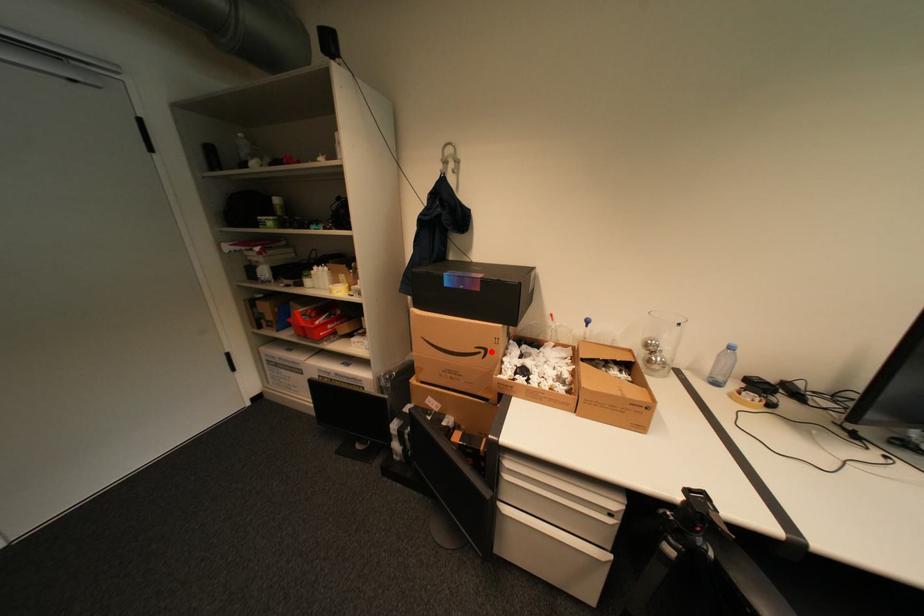
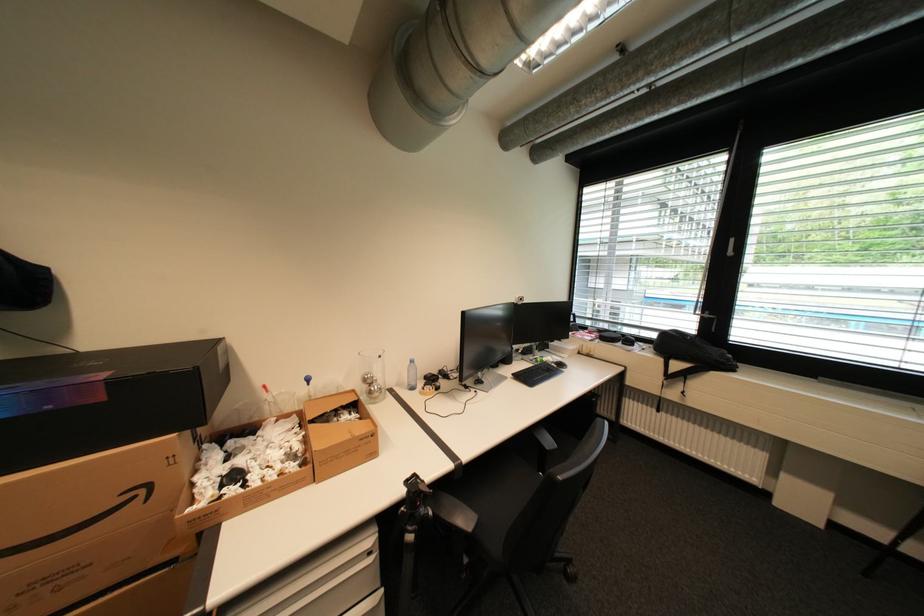
The point at the highlighted location is marked in the first image. Where is the corresponding point in the second image?

(151, 491)